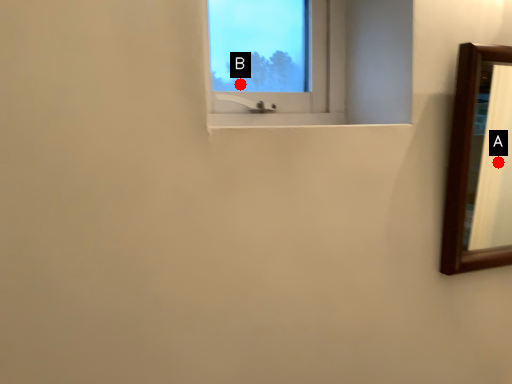
Question: Two points are circled on the image, labeled by A and B beside each circle. Which point is farther to the camera?

Choices:
 (A) A is further
 (B) B is further

Answer: (A)